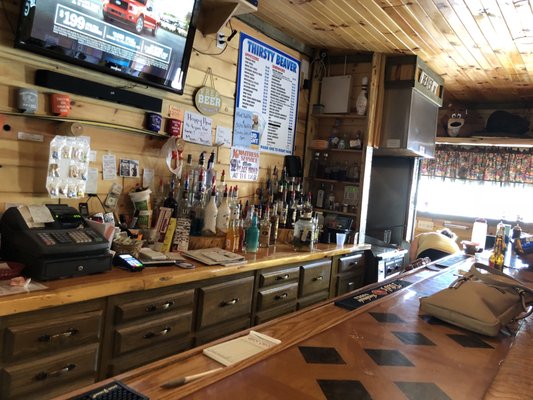
Image resolution: width=533 pixels, height=400 pixels. I want to click on pen, so click(199, 374).